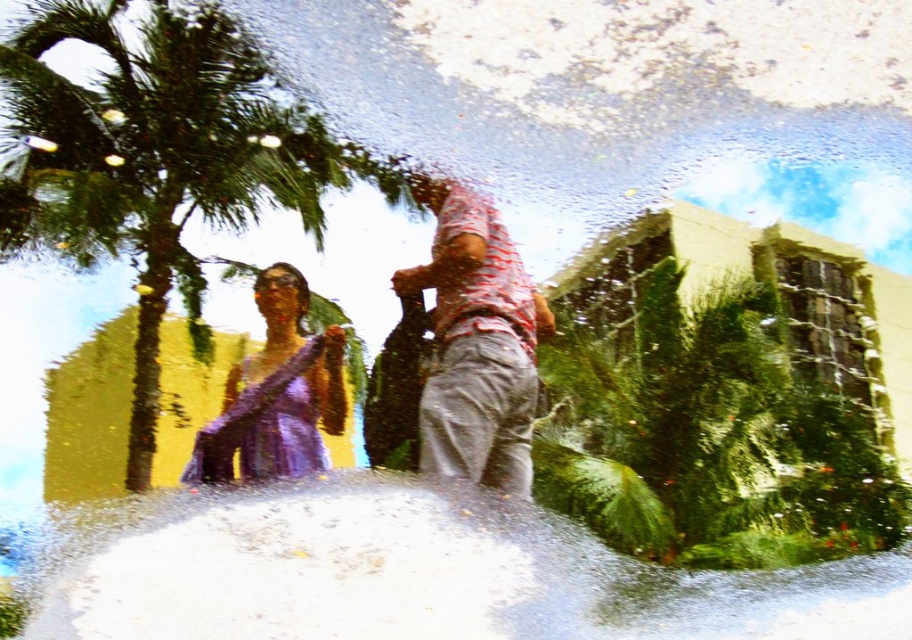
Question: Considering the real-world distances, which object is farthest from the purple satin dress at left?

Choices:
 (A) green leafy palm tree at upper left
 (B) striped cotton shirt at center

Answer: (A)

Question: Is striped cotton shirt at center to the left of purple satin dress at left from the viewer's perspective?

Choices:
 (A) yes
 (B) no

Answer: (B)

Question: Considering the relative positions of green leafy palm tree at upper left and purple satin dress at left in the image provided, where is green leafy palm tree at upper left located with respect to purple satin dress at left?

Choices:
 (A) below
 (B) above

Answer: (B)

Question: Based on their relative distances, which object is farther from the striped cotton shirt at center?

Choices:
 (A) green leafy palm tree at upper left
 (B) purple satin dress at left

Answer: (A)

Question: Can you confirm if green leafy palm tree at upper left is positioned to the left of striped cotton shirt at center?

Choices:
 (A) no
 (B) yes

Answer: (B)

Question: Estimate the real-world distances between objects in this image. Which object is closer to the purple satin dress at left?

Choices:
 (A) green leafy palm tree at upper left
 (B) striped cotton shirt at center

Answer: (B)